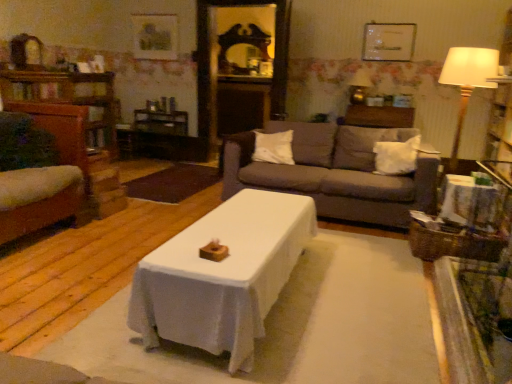
Question: Would you say white soft pillow at center, positioned as the 1th pillow in right-to-left order, is to the left or to the right of wooden picture frame at upper center, placed as the 1th picture frame when sorted from left to right, in the picture?

Choices:
 (A) left
 (B) right

Answer: (B)

Question: Choose the correct answer: Is white soft pillow at center, the second pillow positioned from the left, inside wooden picture frame at upper center, placed as the 1th picture frame when sorted from left to right, or outside it?

Choices:
 (A) inside
 (B) outside

Answer: (B)

Question: Which object is the farthest from the wooden dresser at left?

Choices:
 (A) white soft pillow at center, positioned as the 1th pillow in right-to-left order
 (B) white soft pillow at center, which is the second pillow from right to left
 (C) matte white picture frame at upper center, which ranks as the 1th picture frame in right-to-left order
 (D) wooden side table at right
 (E) wooden picture frame at upper center, acting as the second picture frame starting from the front

Answer: (D)

Question: Considering the real-world distances, which object is farthest from the wooden swivel chair at left?

Choices:
 (A) wooden dresser at left
 (B) wooden picture frame at upper center, positioned as the 2th picture frame in right-to-left order
 (C) white soft pillow at center, which is the second pillow from right to left
 (D) dark gray fabric couch at center
 (E) matte white picture frame at upper center, which is counted as the first picture frame, starting from the front

Answer: (E)